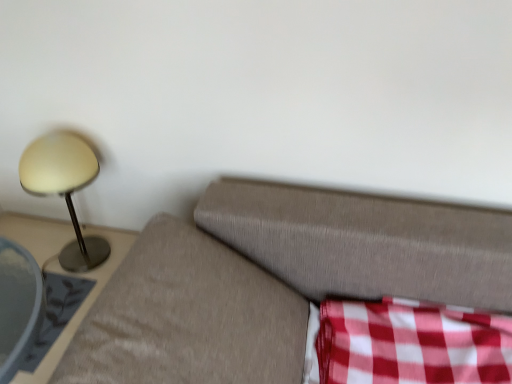
Question: Is point (19, 170) closer or farther from the camera than point (6, 231)?

Choices:
 (A) farther
 (B) closer

Answer: (B)

Question: Relative to metallic gray side table at left, is matte gold lamp at left in front or behind?

Choices:
 (A) front
 (B) behind

Answer: (B)

Question: Which object is the farthest from the metallic gray side table at left?

Choices:
 (A) red checkered fabric at lower right
 (B) matte gold lamp at left

Answer: (A)

Question: Based on their relative distances, which object is farther from the red checkered fabric at lower right?

Choices:
 (A) matte gold lamp at left
 (B) metallic gray side table at left

Answer: (A)